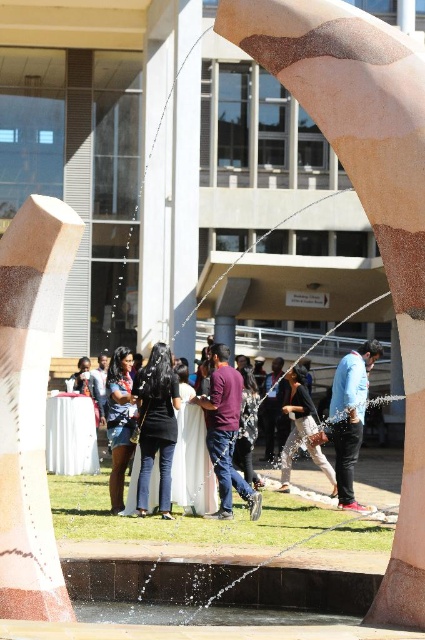
You are a photographer trying to capture a person wearing both the black matte pants at center and the matte black jacket at center. Since both items are on the same person, which piece of clothing is located to the left of the other?

The black matte pants at center is positioned on the left side of the matte black jacket at center.

You are standing in the outdoor area and want to approach both the black matte pants at center and the blue denim jeans at center. Which one should you walk towards first to reach the one closer to you?

You should walk towards the black matte pants at center first because it is closer to you than the blue denim jeans at center.